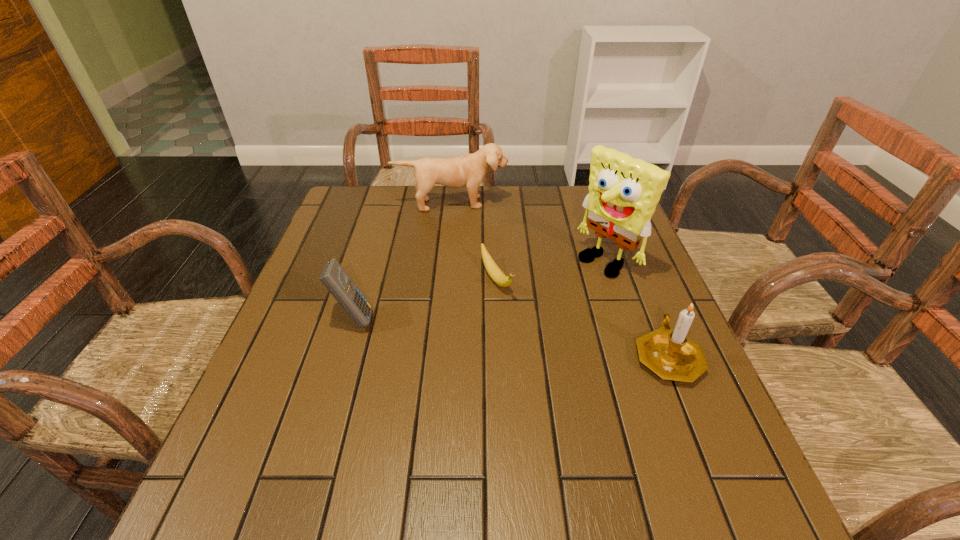
Find the location of `vacant space at the far edge`. vacant space at the far edge is located at coordinates click(x=564, y=218).

You are a GUI agent. You are given a task and a screenshot of the screen. Output one action in this format:
    pyautogui.click(x=<x>, y=<y>)
    Task: Click on the blank space at the near edge of the desktop
    This screenshot has width=960, height=540.
    Given the screenshot: What is the action you would take?
    pyautogui.click(x=410, y=452)

Identify the location of vacant space at the left edge. (338, 339).

Identify the location of blank space at the right edge. (630, 372).

Where is `vacant space at the far left corner of the desktop`? The image size is (960, 540). vacant space at the far left corner of the desktop is located at coordinates (334, 226).

The width and height of the screenshot is (960, 540). Find the location of `free space at the far right corner of the desktop`. free space at the far right corner of the desktop is located at coordinates (578, 187).

You are a GUI agent. You are given a task and a screenshot of the screen. Output one action in this format:
    pyautogui.click(x=<x>, y=<y>)
    Task: Click on the blank space at the near right corner
    Image resolution: width=960 pixels, height=540 pixels.
    Given the screenshot: What is the action you would take?
    pyautogui.click(x=666, y=418)

The height and width of the screenshot is (540, 960). I want to click on free space between the calculator and the tallest object, so click(x=480, y=289).

Locate an element on the screen. blank region between the tallest object and the banana is located at coordinates (551, 270).

The width and height of the screenshot is (960, 540). I want to click on blank region between the candle holder and the calculator, so click(511, 337).